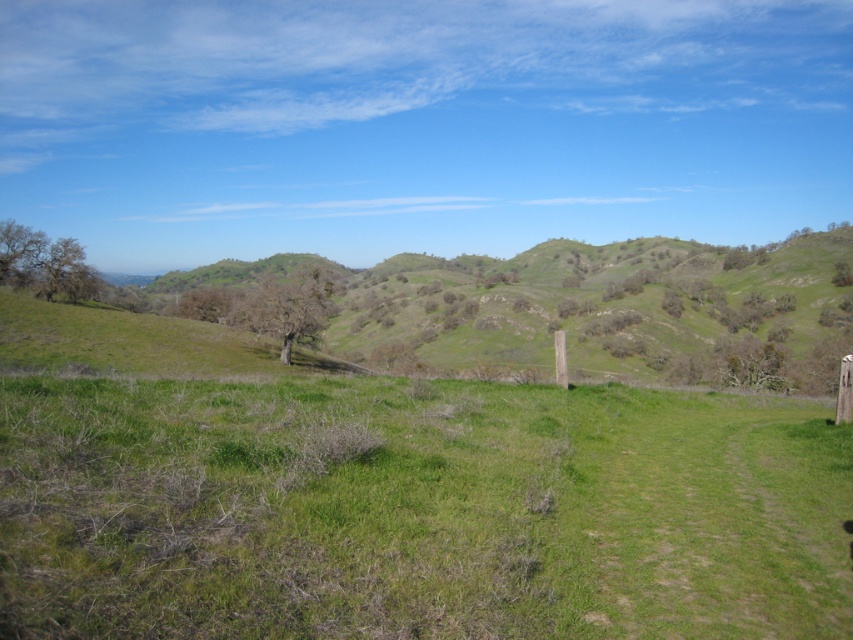
You are standing on the dirt path and want to reach the wooden post at right. Which direction should you walk to avoid the green grassy field at center?

To avoid the green grassy field at center, you should walk towards the right side of the wooden post at right since the field is positioned under it.